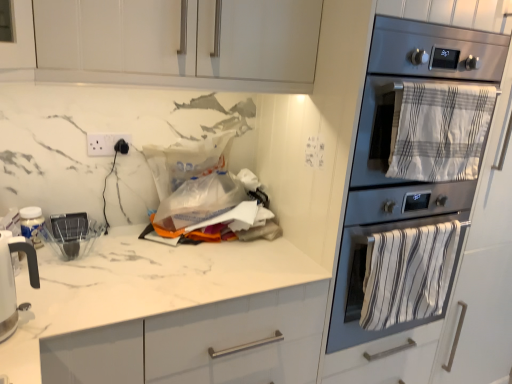
Locate an element on the screen. The image size is (512, 384). free space above white striped towel at right, which is the first blanket from top to bottom (from a real-world perspective) is located at coordinates (438, 81).